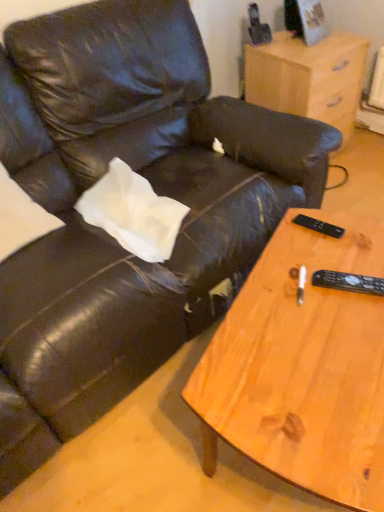
Find the location of a particular element. vacant space positioned to the left of black plastic remote at right, acting as the 2th remote starting from the back is located at coordinates (293, 303).